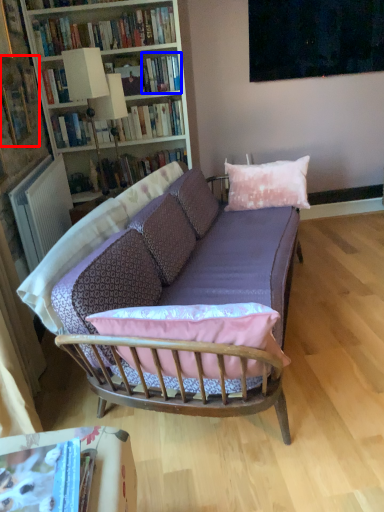
Question: Which point is closer to the camera, book (highlighted by a red box) or book (highlighted by a blue box)?

Choices:
 (A) book
 (B) book

Answer: (A)